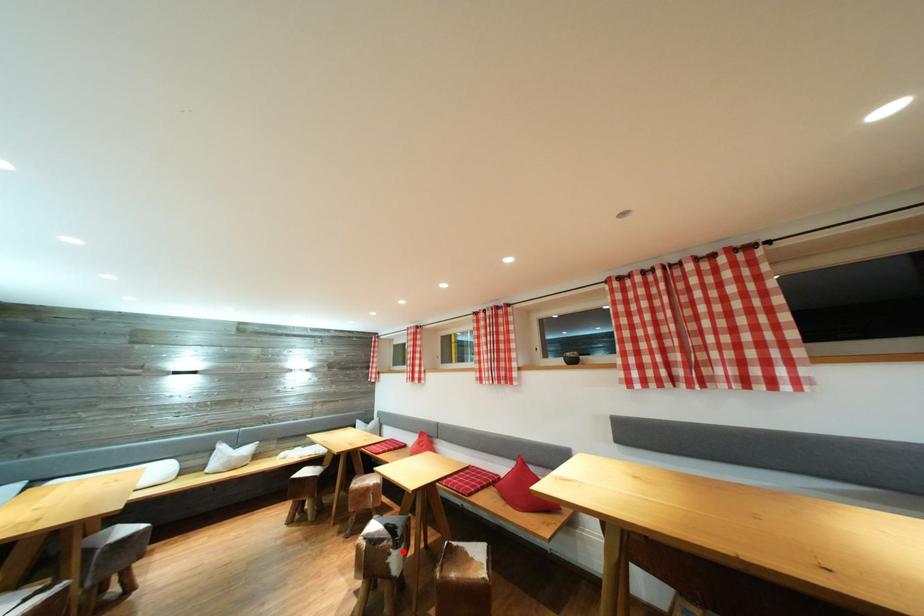
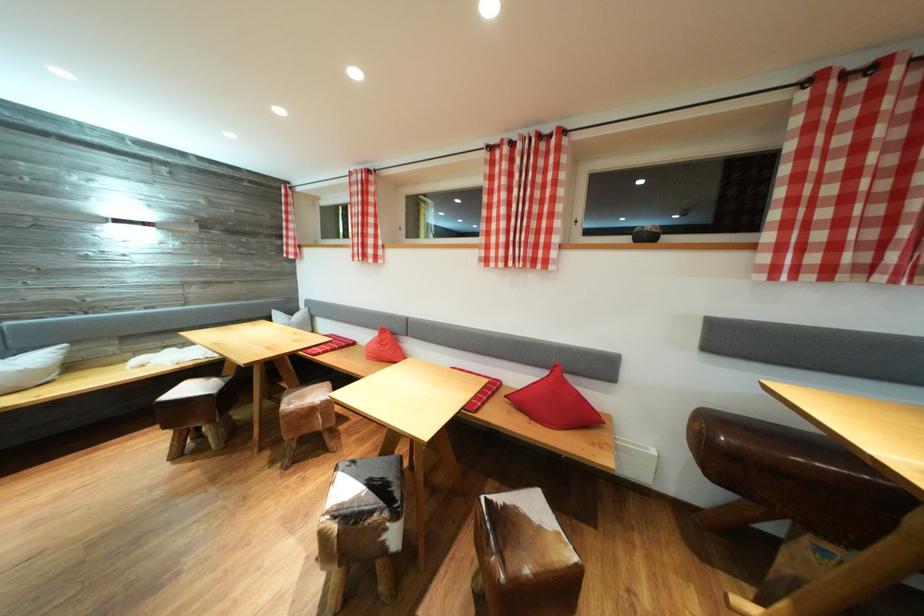
In the second image, find the point that corresponds to the highlighted location in the first image.

(403, 522)